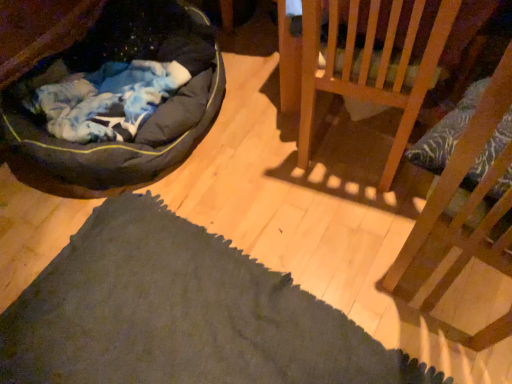
Where is `free space that is in between wooden chair at right, acting as the 1th furniture starting from the front, and wooden chair at upper right, arranged as the first furniture when viewed from the back`? Image resolution: width=512 pixels, height=384 pixels. free space that is in between wooden chair at right, acting as the 1th furniture starting from the front, and wooden chair at upper right, arranged as the first furniture when viewed from the back is located at coordinates (362, 195).